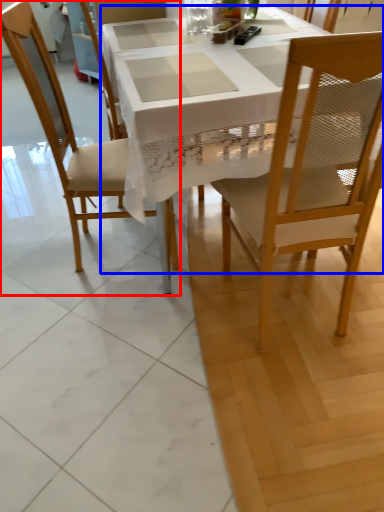
Question: Which object is further to the camera taking this photo, chair (highlighted by a red box) or desk (highlighted by a blue box)?

Choices:
 (A) chair
 (B) desk

Answer: (A)